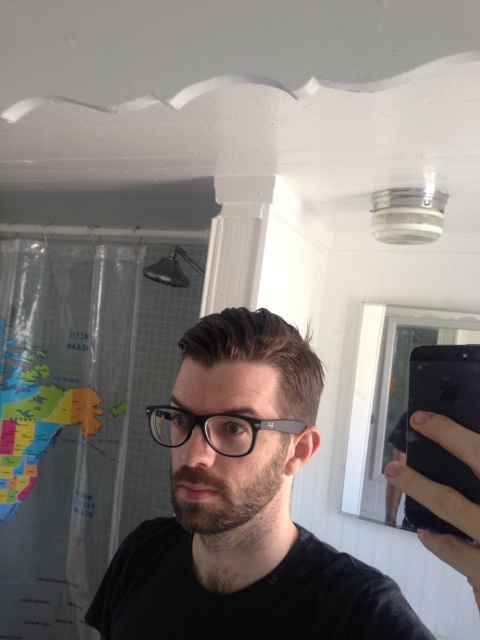
You are trying to take a selfie in a bathroom. You have a matte black glasses at center and a black matte smartphone at upper right. Which object is closer to the camera?

The matte black glasses at center is closer to the camera than the black matte smartphone at upper right because it is in front of it according to the description.